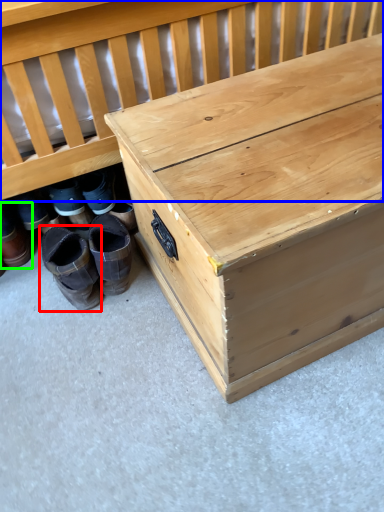
Question: Which is farther away from footwear (highlighted by a red box)? infant bed (highlighted by a blue box) or footwear (highlighted by a green box)?

Choices:
 (A) infant bed
 (B) footwear

Answer: (A)